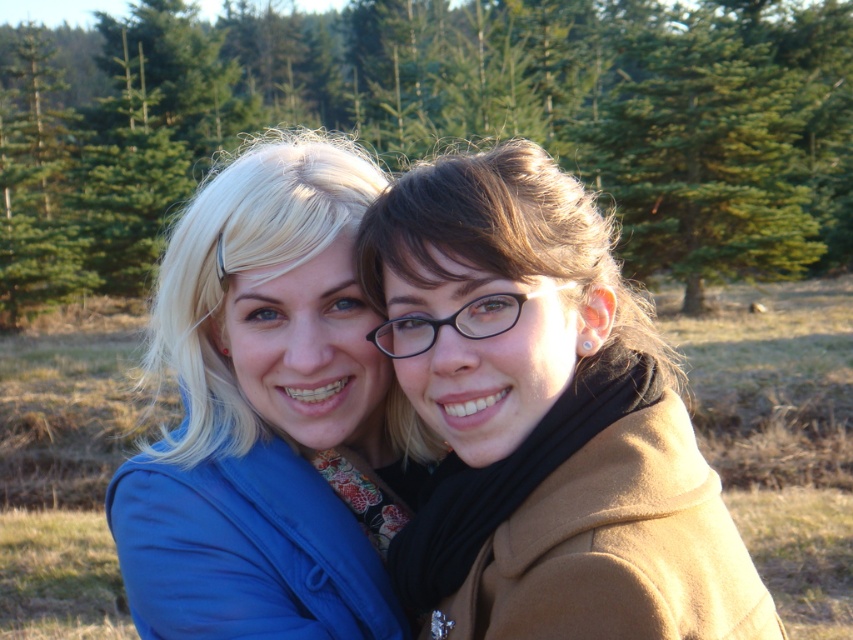
You are taking a photo of the two people in the scene. To ensure the green matte tree at center is not blocking the view, where should you position the camera relative to the tree?

The green matte tree at center is located at point (438, 122), so to avoid blocking the view, position the camera either to the left or right of the tree.

You are trying to decide which coat to wear for a walk in the forest. You see the brown woolen coat at right and the blue fabric jacket at center. Which one is located to the right of the other?

The brown woolen coat at right is positioned on the right side of blue fabric jacket at center.